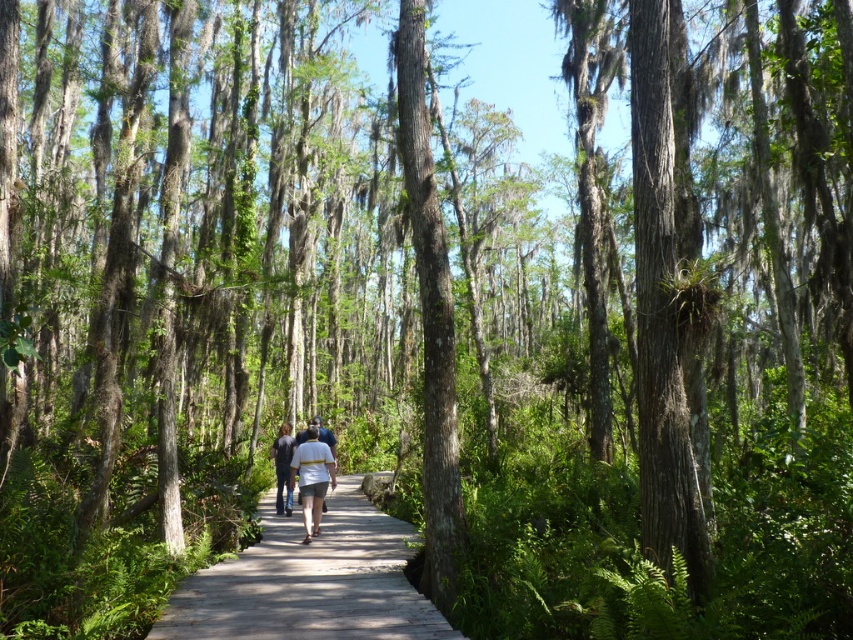
You are a hiker who wants to ensure their clothing items are properly arranged in their backpack. You have a white cotton shirt at center and dark blue jeans at center. Which clothing item is wider when laid flat?

The white cotton shirt at center is wider than the dark blue jeans at center.

You are standing on the wooden boardwalk at center and want to step down onto the dark blue jeans at center. Is the boardwalk higher than the jeans?

The wooden boardwalk at center has a greater height compared to dark blue jeans at center, so yes, the boardwalk is higher than the jeans.